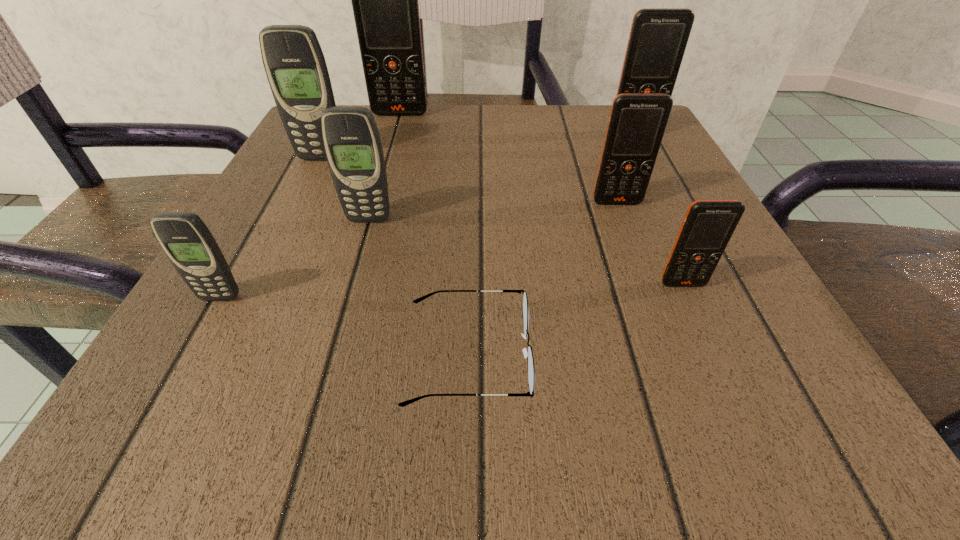
The image size is (960, 540). I want to click on the nearest orange cellular telephone, so click(x=708, y=226).

At what (x,y) coordinates should I click in order to perform the action: click on the third nearest object. Please return your answer as a coordinate pair (x, y). Image resolution: width=960 pixels, height=540 pixels. Looking at the image, I should click on (708, 226).

The width and height of the screenshot is (960, 540). Find the location of `the seventh farthest object`. the seventh farthest object is located at coordinates [x=188, y=243].

Image resolution: width=960 pixels, height=540 pixels. I want to click on the nearest cellular telephone, so click(188, 243).

I want to click on the fourth object from right to left, so click(x=530, y=360).

What are the coordinates of `black spectacles` in the screenshot? It's located at (530, 360).

This screenshot has height=540, width=960. What are the coordinates of `free space located 0.340m on the screen of the farthest cellular telephone` in the screenshot? It's located at (372, 212).

You are a GUI agent. You are given a task and a screenshot of the screen. Output one action in this format:
    pyautogui.click(x=<x>, y=<y>)
    Task: Click on the free space located 0.350m on the screen of the seventh nearest object
    Image resolution: width=960 pixels, height=540 pixels.
    Given the screenshot: What is the action you would take?
    pyautogui.click(x=696, y=252)

Identify the location of free space located 0.210m on the screen of the third farthest cellular telephone. (284, 233).

This screenshot has width=960, height=540. In order to click on vacant region located on the screen of the third nearest cellular telephone in this screenshot , I will do `click(316, 404)`.